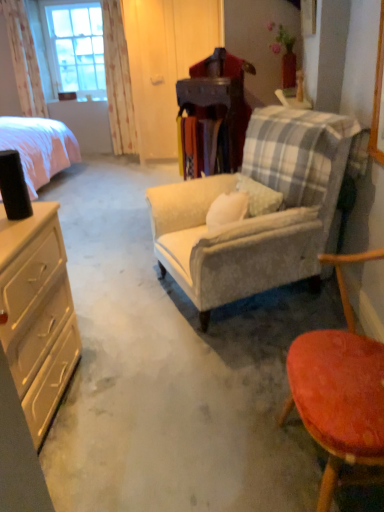
This screenshot has height=512, width=384. In order to click on free point behind smooth orange stool at lower right, positioned as the first chair in front-to-back order in this screenshot , I will do `click(250, 386)`.